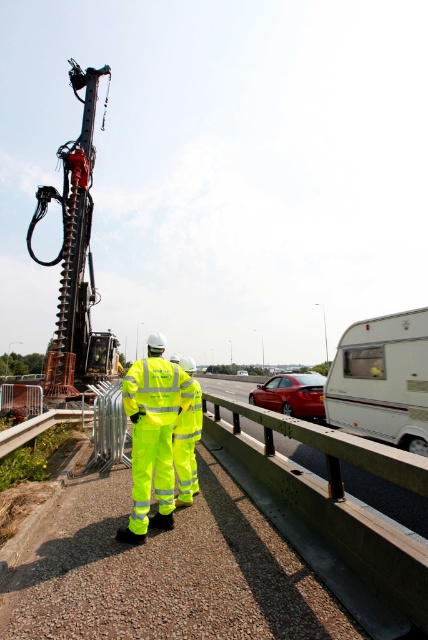
Question: Considering the relative positions of white matte trailer truck at right and neon yellow reflective suit at center in the image provided, where is white matte trailer truck at right located with respect to neon yellow reflective suit at center?

Choices:
 (A) above
 (B) below

Answer: (B)

Question: Where is neon yellow reflective suit at center located in relation to glossy red car at center in the image?

Choices:
 (A) below
 (B) above

Answer: (B)

Question: Which point is closer to the camera?

Choices:
 (A) (122, 397)
 (B) (392, 385)

Answer: (A)

Question: Which point is farther to the camera?

Choices:
 (A) white matte trailer truck at right
 (B) glossy red car at center
 (C) neon yellow reflective suit at center

Answer: (B)

Question: Is white matte trailer truck at right smaller than glossy red car at center?

Choices:
 (A) no
 (B) yes

Answer: (B)

Question: Which point appears farthest from the camera in this image?

Choices:
 (A) (169, 392)
 (B) (359, 336)

Answer: (B)